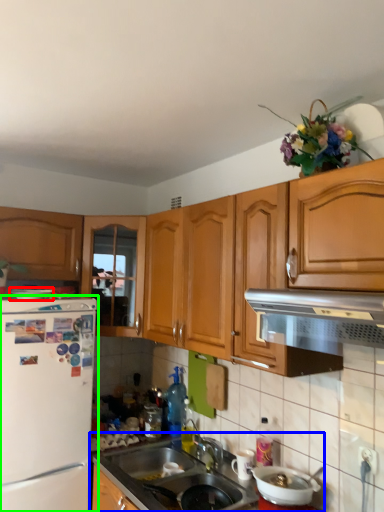
Question: Which is nearer to the appliance (highlighted by a red box)? countertop (highlighted by a blue box) or refrigerator (highlighted by a green box).

Choices:
 (A) countertop
 (B) refrigerator

Answer: (B)